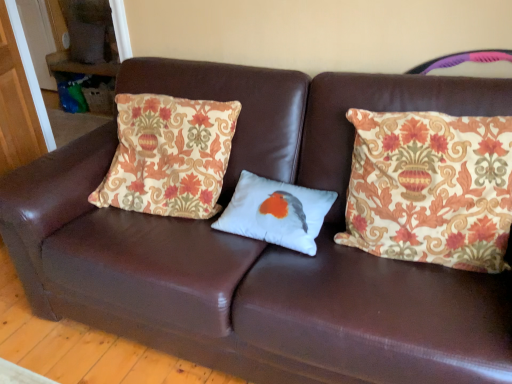
Question: Is floral-patterned fabric pillow at left, the 1th pillow when ordered from left to right, in front of patterned fabric pillow at right, positioned as the third pillow in left-to-right order?

Choices:
 (A) yes
 (B) no

Answer: (B)

Question: Can you confirm if floral-patterned fabric pillow at left, marked as the 3th pillow in a right-to-left arrangement, is thinner than patterned fabric pillow at right, acting as the 1th pillow starting from the right?

Choices:
 (A) no
 (B) yes

Answer: (A)

Question: Considering the relative positions of floral-patterned fabric pillow at left, the 1th pillow when ordered from left to right, and patterned fabric pillow at right, acting as the 1th pillow starting from the right, in the image provided, is floral-patterned fabric pillow at left, the 1th pillow when ordered from left to right, to the left of patterned fabric pillow at right, acting as the 1th pillow starting from the right, from the viewer's perspective?

Choices:
 (A) yes
 (B) no

Answer: (A)

Question: Does floral-patterned fabric pillow at left, the 1th pillow when ordered from left to right, appear on the right side of patterned fabric pillow at right, acting as the 1th pillow starting from the right?

Choices:
 (A) yes
 (B) no

Answer: (B)

Question: Is floral-patterned fabric pillow at left, marked as the 3th pillow in a right-to-left arrangement, not near patterned fabric pillow at right, positioned as the third pillow in left-to-right order?

Choices:
 (A) no
 (B) yes

Answer: (A)

Question: Is floral-patterned fabric pillow at left, marked as the 3th pillow in a right-to-left arrangement, further to camera compared to patterned fabric pillow at right, positioned as the third pillow in left-to-right order?

Choices:
 (A) yes
 (B) no

Answer: (A)

Question: Is patterned fabric pillow at right, positioned as the third pillow in left-to-right order, oriented away from white matte pillow with bird design at center, positioned as the second pillow in left-to-right order?

Choices:
 (A) no
 (B) yes

Answer: (A)

Question: Is patterned fabric pillow at right, positioned as the third pillow in left-to-right order, beside white matte pillow with bird design at center, positioned as the second pillow in left-to-right order?

Choices:
 (A) no
 (B) yes

Answer: (A)

Question: Is patterned fabric pillow at right, acting as the 1th pillow starting from the right, bigger than white matte pillow with bird design at center, marked as the second pillow in a right-to-left arrangement?

Choices:
 (A) no
 (B) yes

Answer: (B)

Question: Considering the relative positions of patterned fabric pillow at right, positioned as the third pillow in left-to-right order, and white matte pillow with bird design at center, marked as the second pillow in a right-to-left arrangement, in the image provided, is patterned fabric pillow at right, positioned as the third pillow in left-to-right order, to the left of white matte pillow with bird design at center, marked as the second pillow in a right-to-left arrangement, from the viewer's perspective?

Choices:
 (A) no
 (B) yes

Answer: (A)

Question: Is patterned fabric pillow at right, acting as the 1th pillow starting from the right, smaller than white matte pillow with bird design at center, positioned as the second pillow in left-to-right order?

Choices:
 (A) no
 (B) yes

Answer: (A)

Question: Is patterned fabric pillow at right, acting as the 1th pillow starting from the right, in front of white matte pillow with bird design at center, positioned as the second pillow in left-to-right order?

Choices:
 (A) no
 (B) yes

Answer: (B)

Question: Can you confirm if floral-patterned fabric pillow at left, marked as the 3th pillow in a right-to-left arrangement, is bigger than white matte pillow with bird design at center, marked as the second pillow in a right-to-left arrangement?

Choices:
 (A) no
 (B) yes

Answer: (B)